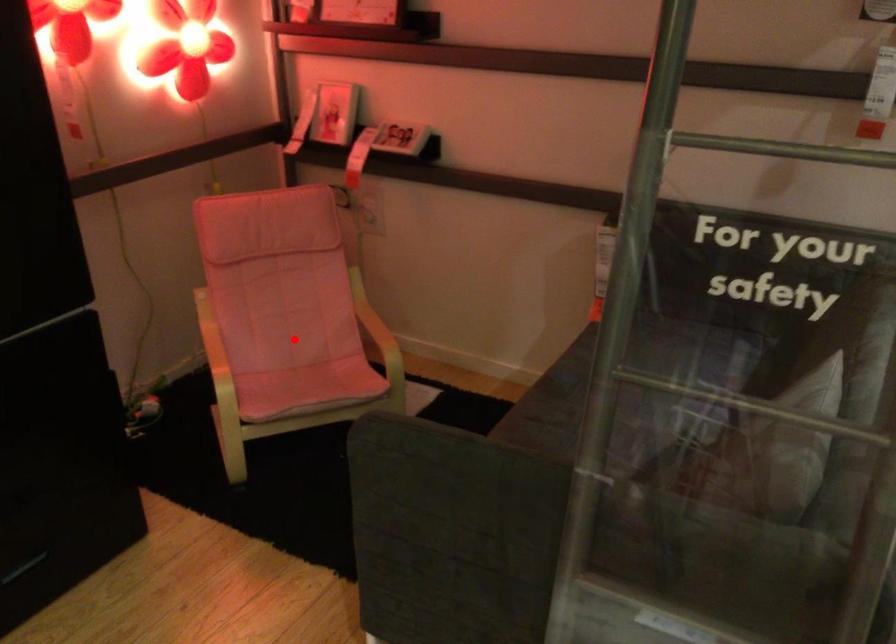
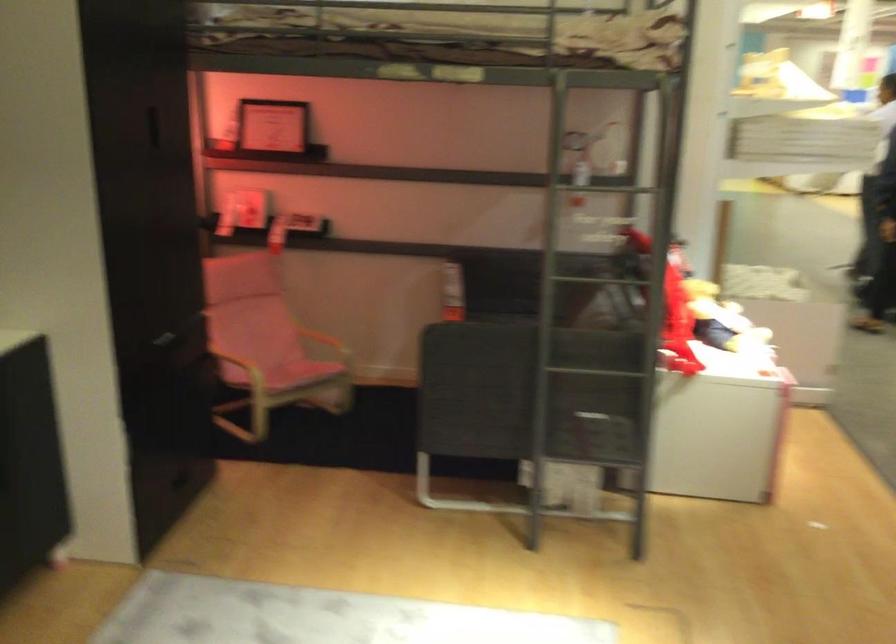
Find the pixel in the second image that matches the highlighted location in the first image.

(268, 353)